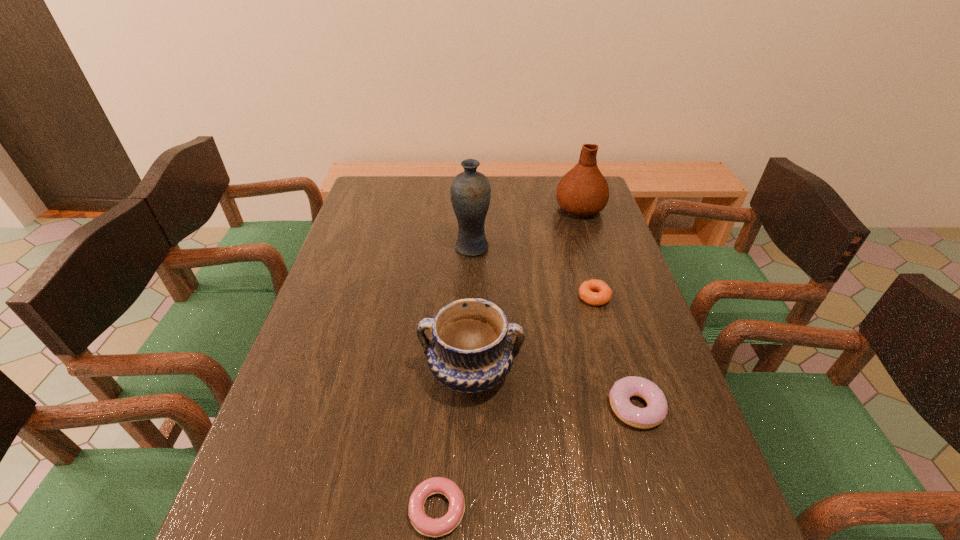
Where is `free region located 0.060m on the side of the second tallest object with the handle`? This screenshot has width=960, height=540. free region located 0.060m on the side of the second tallest object with the handle is located at coordinates (573, 186).

Identify the location of free spot located on the side of the second tallest object with the handle. This screenshot has height=540, width=960. (571, 182).

This screenshot has width=960, height=540. In order to click on vacant space located 0.200m on the front of the third tallest object in this screenshot , I will do `click(468, 505)`.

Find the location of a particular element. Image resolution: width=960 pixels, height=540 pixels. blank area located on the left of the third shortest object is located at coordinates (563, 408).

Where is `vacant area located on the front of the fifth tallest object`? vacant area located on the front of the fifth tallest object is located at coordinates (637, 449).

Where is `object that is positioned at the far edge`? object that is positioned at the far edge is located at coordinates [x=583, y=191].

This screenshot has height=540, width=960. What are the coordinates of `pitcher that is positioned at the right edge` in the screenshot? It's located at (583, 191).

Locate an element on the screen. object that is at the far right corner is located at coordinates (583, 191).

In order to click on vacant space at the far edge of the desktop in this screenshot , I will do `click(437, 187)`.

Identify the location of free space at the left edge. (309, 377).